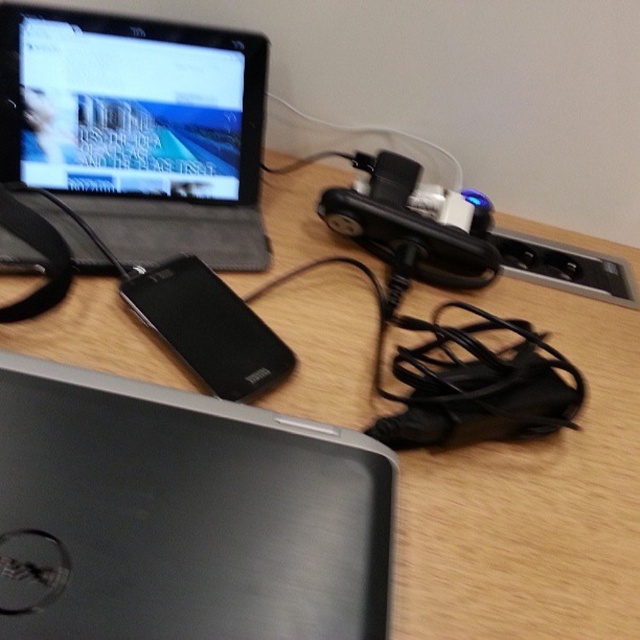
Question: Considering the real-world distances, which object is closest to the black brushed metal laptop at center?

Choices:
 (A) black matte speaker at center
 (B) matte black laptop at upper left

Answer: (A)

Question: Is black brushed metal laptop at center below matte black laptop at upper left?

Choices:
 (A) yes
 (B) no

Answer: (A)

Question: Is black brushed metal laptop at center to the right of black matte speaker at center from the viewer's perspective?

Choices:
 (A) yes
 (B) no

Answer: (A)

Question: Among these points, which one is farthest from the camera?

Choices:
 (A) (168, 304)
 (B) (294, 586)

Answer: (A)

Question: Does black brushed metal laptop at center have a lesser width compared to matte black laptop at upper left?

Choices:
 (A) no
 (B) yes

Answer: (A)

Question: Which object is farther from the camera taking this photo?

Choices:
 (A) matte black laptop at upper left
 (B) black matte speaker at center
 (C) black brushed metal laptop at center

Answer: (A)